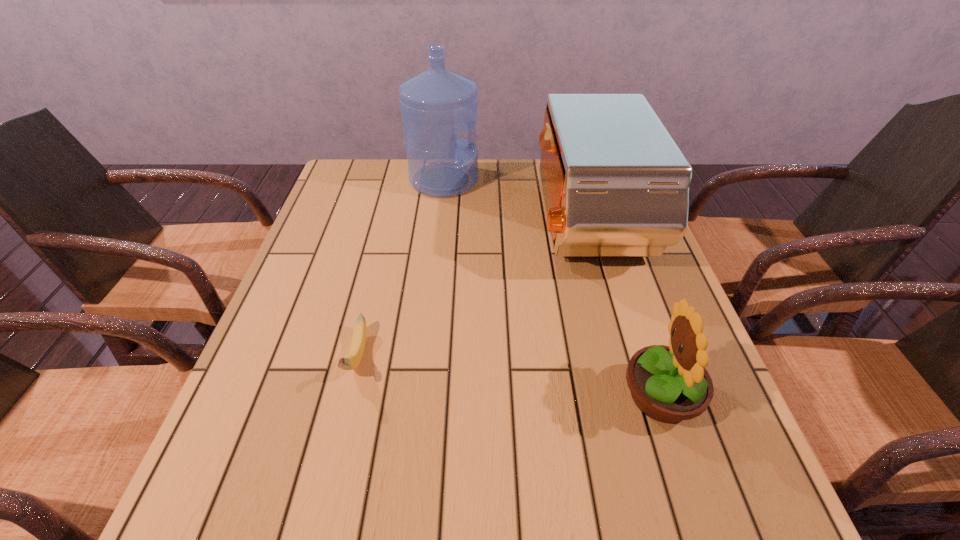
At what (x,y) coordinates should I click in order to perform the action: click on vacant position at the near edge of the desktop. Please return your answer as a coordinate pair (x, y). Image resolution: width=960 pixels, height=540 pixels. Looking at the image, I should click on (501, 509).

Identify the location of free space at the left edge of the desktop. (351, 210).

The width and height of the screenshot is (960, 540). What are the coordinates of `vacant region at the right edge of the desktop` in the screenshot? It's located at (751, 471).

In the image, there is a desktop. In order to click on vacant space at the far left corner in this screenshot , I will do `click(351, 200)`.

In the image, there is a desktop. Where is `vacant space at the near left corner`? Image resolution: width=960 pixels, height=540 pixels. vacant space at the near left corner is located at coordinates (241, 504).

You are a GUI agent. You are given a task and a screenshot of the screen. Output one action in this format:
    pyautogui.click(x=<x>, y=<y>)
    Task: Click on the vacant space at the near right corner of the desktop
    The height and width of the screenshot is (540, 960).
    Given the screenshot: What is the action you would take?
    pyautogui.click(x=704, y=526)

Locate an element on the screen. free space between the third tallest object and the leftmost object is located at coordinates (509, 376).

This screenshot has height=540, width=960. Find the location of `empty location between the third shortest object and the sunflower`. empty location between the third shortest object and the sunflower is located at coordinates [624, 309].

The height and width of the screenshot is (540, 960). What are the coordinates of `empty space between the water jug and the leftmost object` in the screenshot? It's located at (400, 268).

The height and width of the screenshot is (540, 960). I want to click on free point between the toaster oven and the third tallest object, so pyautogui.click(x=624, y=309).